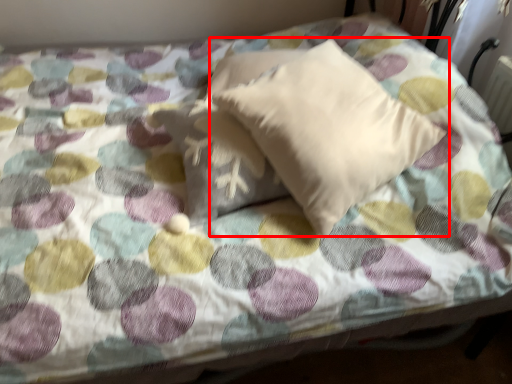
Question: From the image's perspective, what is the correct spatial relationship of pillow (annotated by the red box) in relation to pillow?

Choices:
 (A) above
 (B) below

Answer: (A)